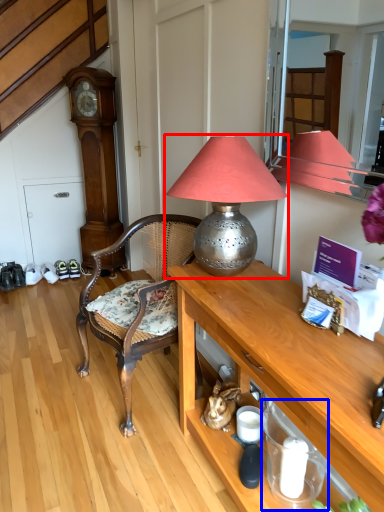
Question: Which object appears farthest to the camera in this image, lamp (highlighted by a red box) or tableware (highlighted by a blue box)?

Choices:
 (A) lamp
 (B) tableware

Answer: (B)